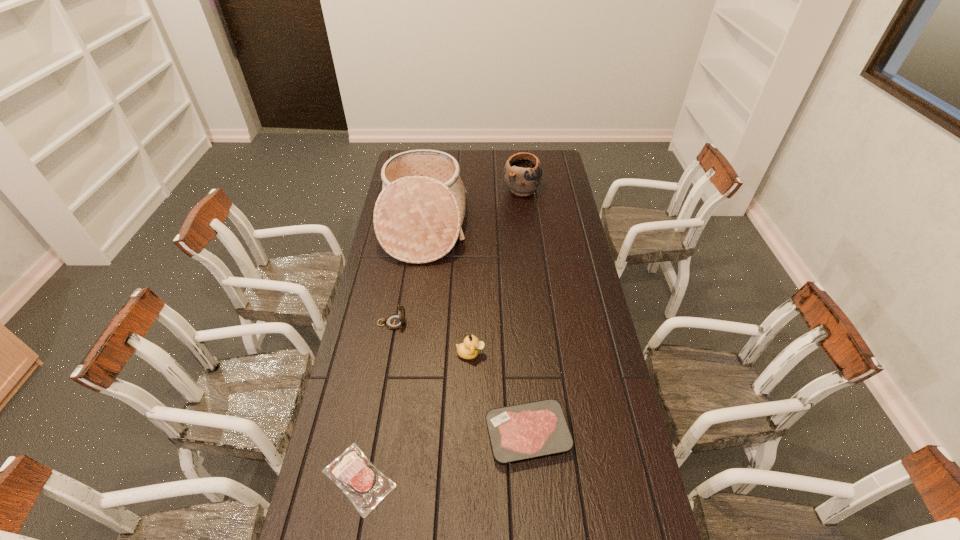
The width and height of the screenshot is (960, 540). I want to click on vacant space in between the right steak and the fifth shortest object, so click(524, 312).

Identify which object is located as the third nearest to the fifth tallest object. Please provide its 2D coordinates. Your answer should be formatted as a tuple, i.e. [(x, y)], where the tuple contains the x and y coordinates of a point satisfying the conditions above.

[(394, 321)]

Where is `the third closest object to the tallest object`? the third closest object to the tallest object is located at coordinates (469, 349).

The height and width of the screenshot is (540, 960). I want to click on vacant position in the image that satisfies the following two spatial constraints: 1. on the back side of the fifth tallest object; 2. on the left side of the pottery, so click(508, 190).

Image resolution: width=960 pixels, height=540 pixels. I want to click on vacant region that satisfies the following two spatial constraints: 1. with the lid open on the right steak; 2. on the right side of the basket, so (x=394, y=434).